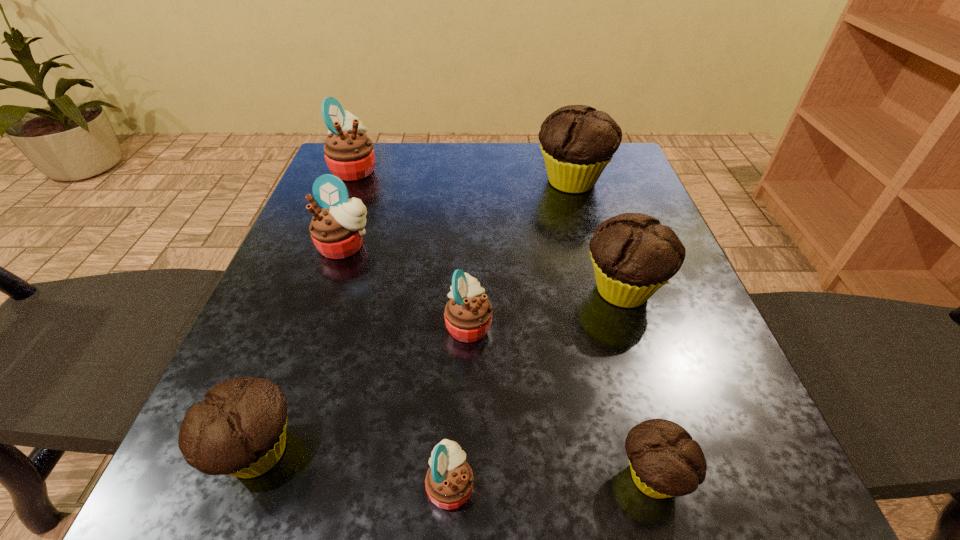
You are a GUI agent. You are given a task and a screenshot of the screen. Output one action in this format:
    pyautogui.click(x=<x>, y=<y>)
    Task: Click on the farthest pink muffin
    
    Given the screenshot: What is the action you would take?
    pyautogui.click(x=349, y=153)

I want to click on the farthest chocolate muffin, so click(577, 141).

Where is `the second farthest pink muffin`? The width and height of the screenshot is (960, 540). the second farthest pink muffin is located at coordinates (337, 230).

This screenshot has width=960, height=540. I want to click on the third nearest chocolate muffin, so click(x=633, y=255).

Where is `the second smallest pink muffin`? the second smallest pink muffin is located at coordinates (468, 314).

The height and width of the screenshot is (540, 960). Find the location of `the leftmost chocolate muffin`. the leftmost chocolate muffin is located at coordinates (239, 430).

Locate an element on the screen. the smallest pink muffin is located at coordinates (449, 481).

Where is `the smallest chocolate muffin`? The width and height of the screenshot is (960, 540). the smallest chocolate muffin is located at coordinates (665, 461).

Identify the location of vacant area located 0.100m on the front-facing side of the farthest pink muffin. (419, 169).

The image size is (960, 540). I want to click on vacant space located on the left of the biggest chocolate muffin, so click(496, 181).